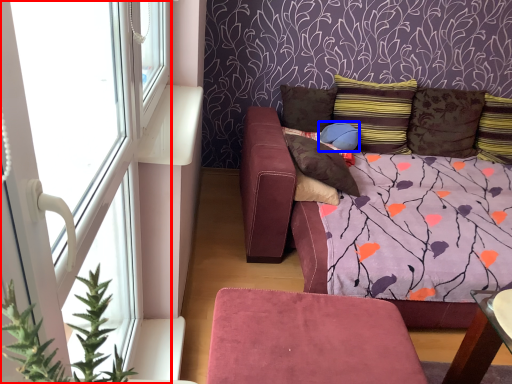
Question: Which of the following is the farthest to the observer, window (highlighted by a red box) or pillow (highlighted by a blue box)?

Choices:
 (A) window
 (B) pillow

Answer: (B)